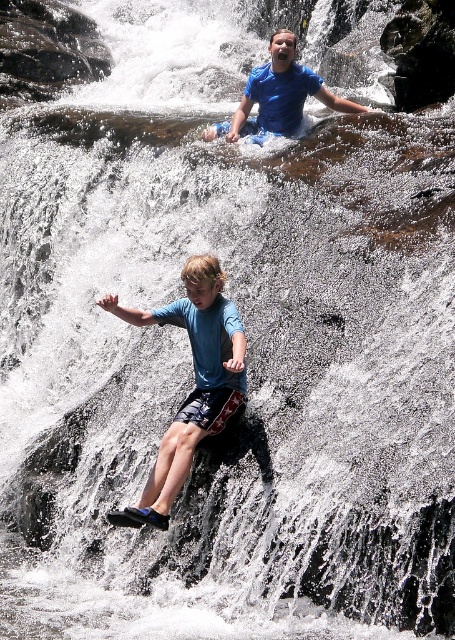
You are standing at the point marked as point (x=195, y=381) in the image. What object is directly under your feet?

The point (x=195, y=381) is on blue fabric shorts at center, so the object directly under your feet is the blue fabric shorts at center.

You are a photographer trying to capture the perfect shot of the two people at the waterfall. You notice the blue fabric shorts at center and the blue cotton shirt at upper center. Which of these items appears narrower in the photo?

The blue fabric shorts at center appears narrower compared to the blue cotton shirt at upper center.